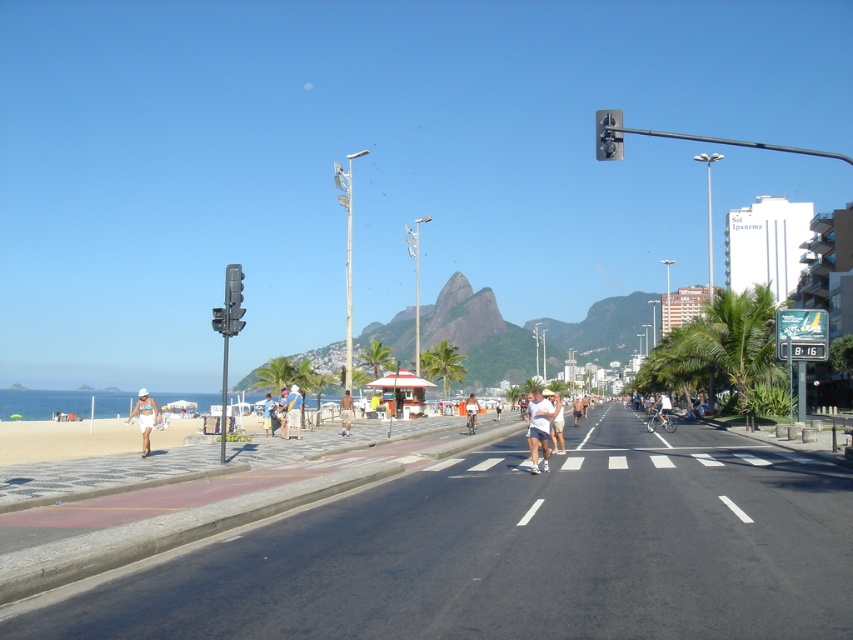
Question: Does light blue denim shorts at center have a smaller size compared to light blue shorts at center?

Choices:
 (A) yes
 (B) no

Answer: (B)

Question: Is white cotton shirt at center bigger than white matte shirt at center?

Choices:
 (A) yes
 (B) no

Answer: (B)

Question: Which of these objects is positioned closest to the white matte shorts at center?

Choices:
 (A) tan fabric shorts at center
 (B) tan skin person at center
 (C) white fabric shorts at lower left
 (D) light blue shorts at center

Answer: (B)

Question: Among these points, which one is farthest from the camera?

Choices:
 (A) (264, 413)
 (B) (351, 413)
 (C) (476, 419)

Answer: (A)

Question: Observing the image, what is the correct spatial positioning of white fabric shorts at lower left in reference to white cotton shirt at center?

Choices:
 (A) right
 (B) left

Answer: (B)

Question: Which of the following is the closest to the observer?

Choices:
 (A) white cotton shirt at center
 (B) white matte shorts at center
 (C) white matte shirt at center

Answer: (B)